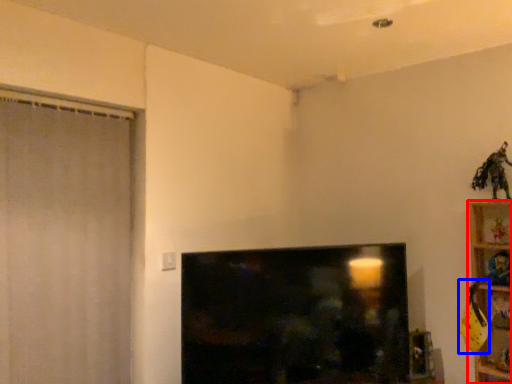
Question: Which point is further to the camera, furniture (highlighted by a red box) or toy (highlighted by a blue box)?

Choices:
 (A) furniture
 (B) toy

Answer: (B)